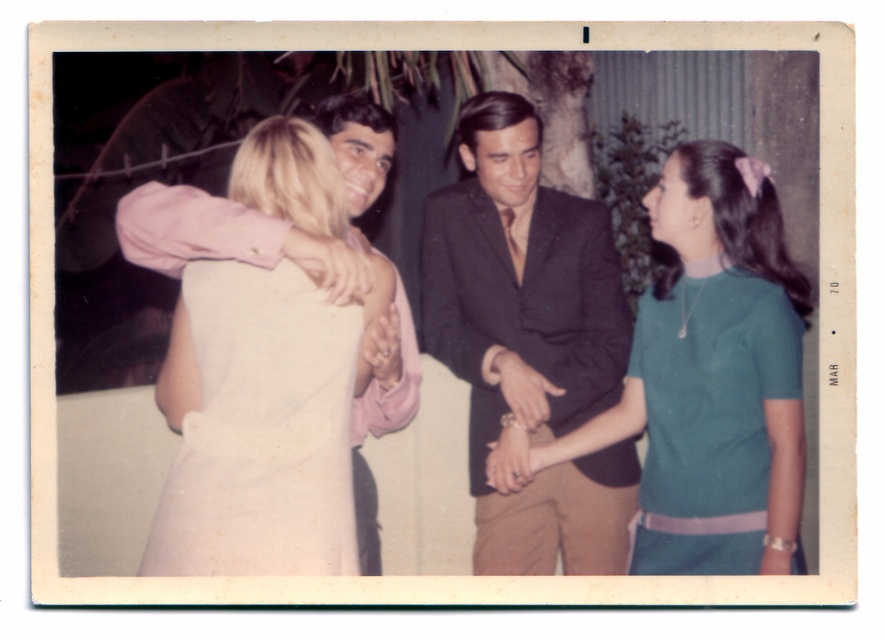
Between point (531, 262) and point (345, 388), which one is positioned behind?

Positioned behind is point (531, 262).

The height and width of the screenshot is (640, 885). What do you see at coordinates (529, 346) in the screenshot? I see `dark brown suit at center` at bounding box center [529, 346].

Is point (439, 346) in front of point (260, 504)?

No, it is not.

I want to click on dark brown suit at center, so click(529, 346).

Is point (504, 392) farther from camera compared to point (741, 403)?

Yes, point (504, 392) is farther from viewer.

How distant is dark brown suit at center from teal knitted dress at right?

dark brown suit at center and teal knitted dress at right are 13.19 inches apart from each other.

Is point (528, 336) positioned before point (701, 317)?

No, (528, 336) is behind (701, 317).

Where is `dark brown suit at center`? The width and height of the screenshot is (885, 640). dark brown suit at center is located at coordinates (529, 346).

Between green knit dress at center and light pink fabric dress at center, which one appears on the left side from the viewer's perspective?

light pink fabric dress at center

Is point (730, 339) farther from viewer compared to point (291, 563)?

Yes, point (730, 339) is farther from viewer.

This screenshot has height=640, width=885. I want to click on green knit dress at center, so click(714, 352).